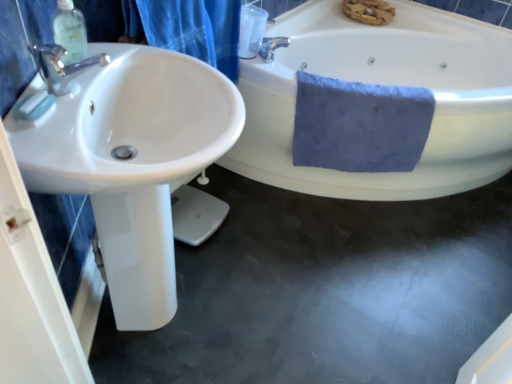
Question: Is point (339, 185) closer or farther from the camera than point (74, 28)?

Choices:
 (A) closer
 (B) farther

Answer: (B)

Question: From the image's perspective, is white glossy bathtub at upper right positioned above or below clear plastic soap dispenser at upper left?

Choices:
 (A) below
 (B) above

Answer: (B)

Question: Which object is positioned closest to the white glossy bathtub at upper right?

Choices:
 (A) white glossy sink at left
 (B) clear plastic soap dispenser at upper left
 (C) blue soft towel at right
 (D) blue fabric shower curtain at upper left

Answer: (C)

Question: Which is nearer to the white glossy bathtub at upper right?

Choices:
 (A) clear plastic soap dispenser at upper left
 (B) blue soft towel at right
 (C) blue fabric shower curtain at upper left
 (D) white glossy sink at left

Answer: (B)